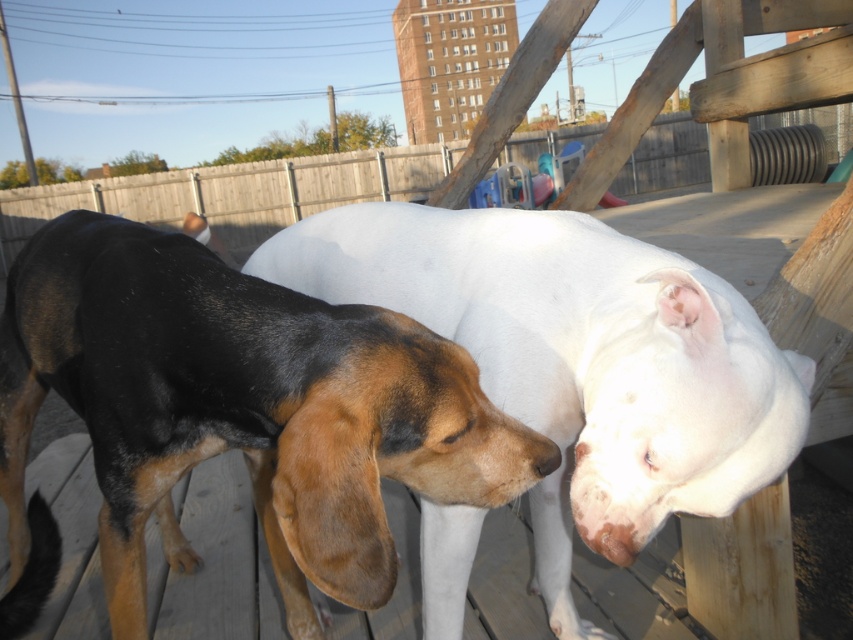
You are standing on the wooden deck and want to place a treat at the point with coordinates (233, 413). Which dog should you target to ensure the treat lands on its fur?

The point with coordinates (233, 413) is on the brown and black fur dog at center, so you should target that dog to ensure the treat lands on its fur.

You are standing on the wooden deck where the two dogs are interacting. You notice two specific points marked on the deck. The first point is at coordinates point(x=28, y=253) and the second is at point(x=270, y=241). If you were to walk from the first point to the second point, in which direction would you be moving relative to the deck?

Moving from point(x=28, y=253) to point(x=270, y=241) would involve moving backward since point(x=28, y=253) is in front of point(x=270, y=241).

From the picture: You are a dog owner who wants to ensure both dogs have enough space to move comfortably on the deck. Given the size difference between the brown and black fur dog at center and the white smooth dog at center, which dog requires more space to accommodate its size?

The brown and black fur dog at center requires more space because it has a larger size compared to the white smooth dog at center.